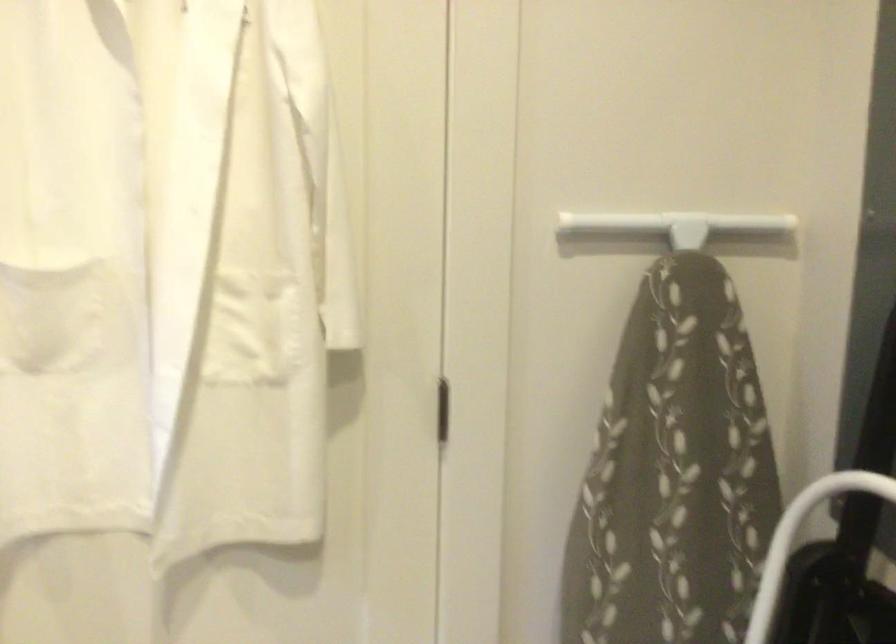
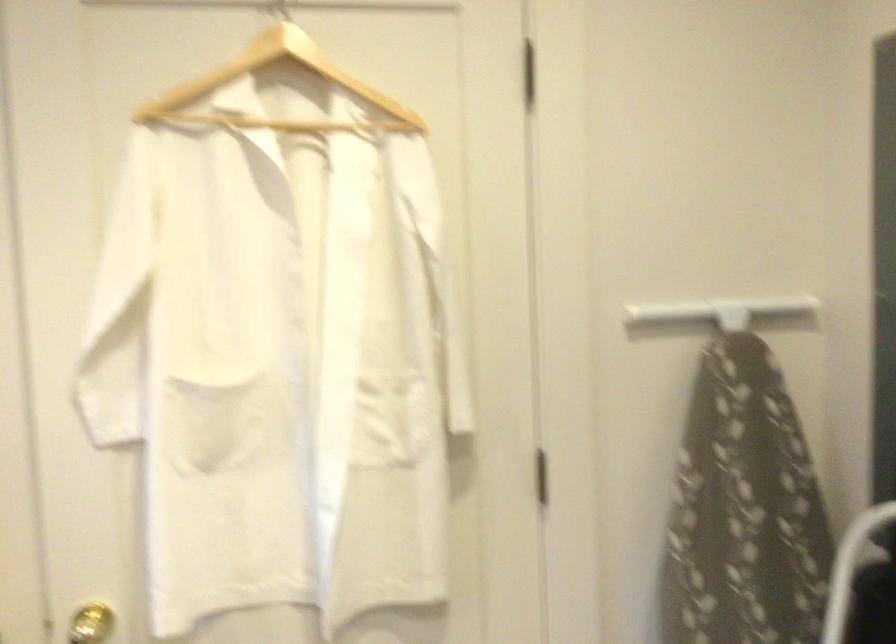
Based on the photo, which direction would the cameraman need to move to produce the second image?

The movement direction of the cameraman is left, backward.